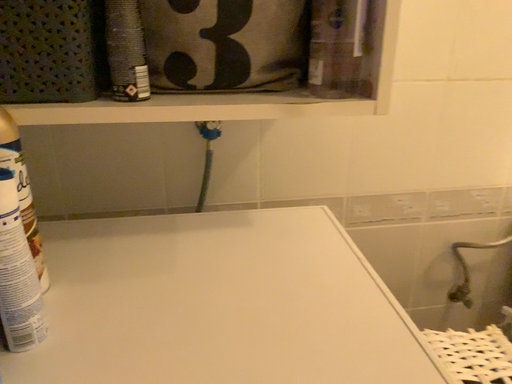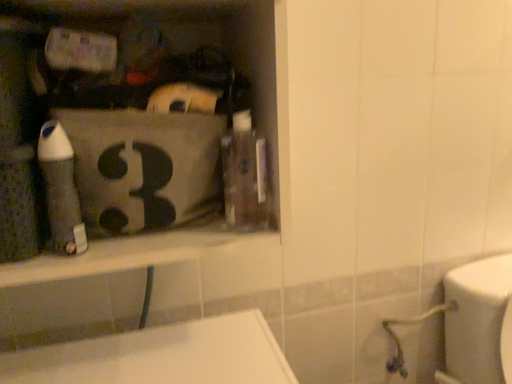
Question: How did the camera likely rotate when shooting the video?

Choices:
 (A) rotated downward
 (B) rotated upward

Answer: (B)